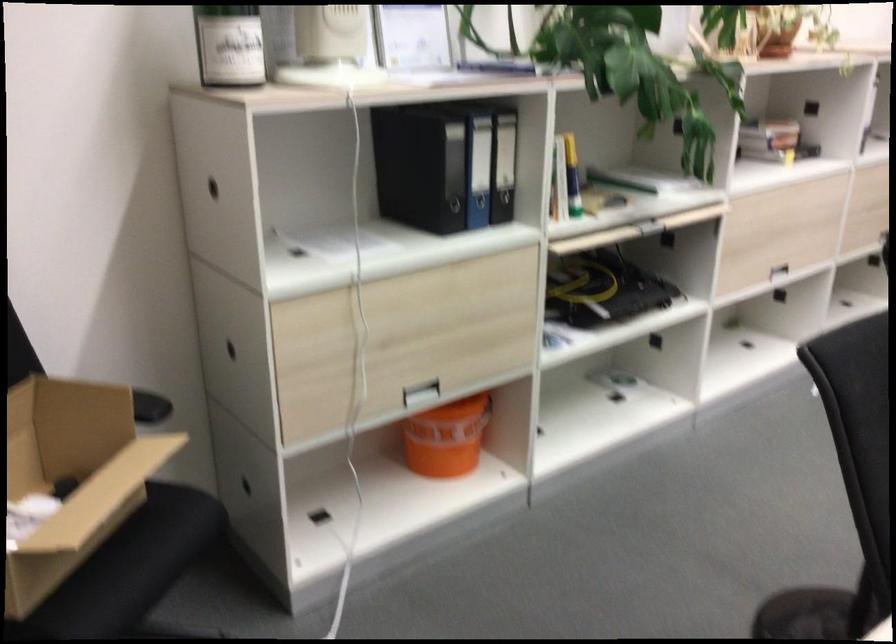
Image resolution: width=896 pixels, height=644 pixels. What do you see at coordinates (848, 485) in the screenshot? I see `a chair sitting surface` at bounding box center [848, 485].